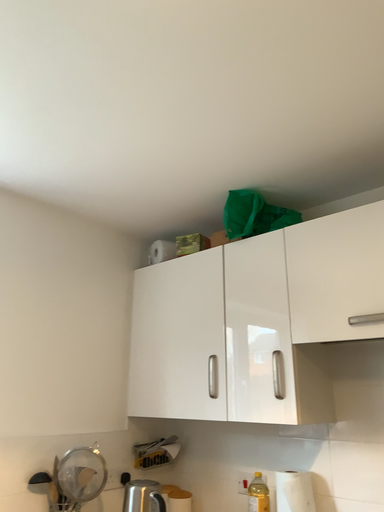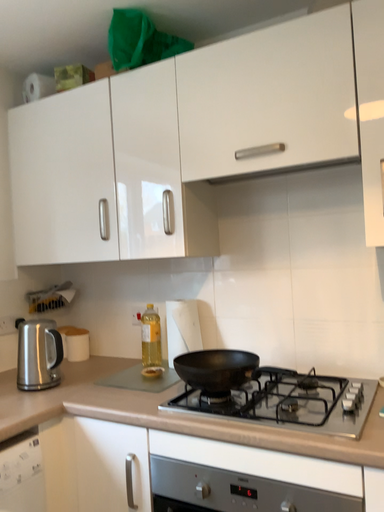
Question: How did the camera likely rotate when shooting the video?

Choices:
 (A) rotated right
 (B) rotated left

Answer: (A)